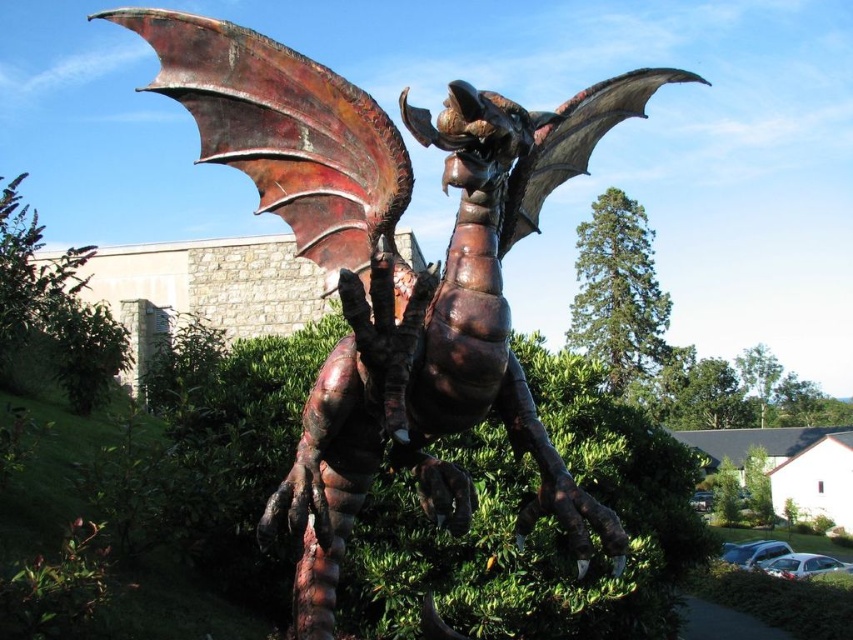
Question: Estimate the real-world distances between objects in this image. Which object is farther from the green leafy hedge at center?

Choices:
 (A) rusty metal wing at upper center
 (B) rusty metal dragon at center
 (C) rusty metal wing at upper left
 (D) green leafy bush at upper center

Answer: (D)

Question: Which point is farther to the camera?

Choices:
 (A) (604, 224)
 (B) (666, 602)
 (C) (525, 228)
 (D) (4, 374)

Answer: (A)

Question: Is green leafy bush at upper center smaller than rusty metal wing at upper center?

Choices:
 (A) yes
 (B) no

Answer: (B)

Question: Which point is closer to the camera?

Choices:
 (A) (271, 145)
 (B) (18, 256)

Answer: (A)

Question: Considering the relative positions of green leafy hedge at center and rusty metal wing at upper left in the image provided, where is green leafy hedge at center located with respect to rusty metal wing at upper left?

Choices:
 (A) below
 (B) above

Answer: (A)

Question: Can you confirm if green leafy hedge at center is bigger than rusty metal wing at upper left?

Choices:
 (A) yes
 (B) no

Answer: (A)